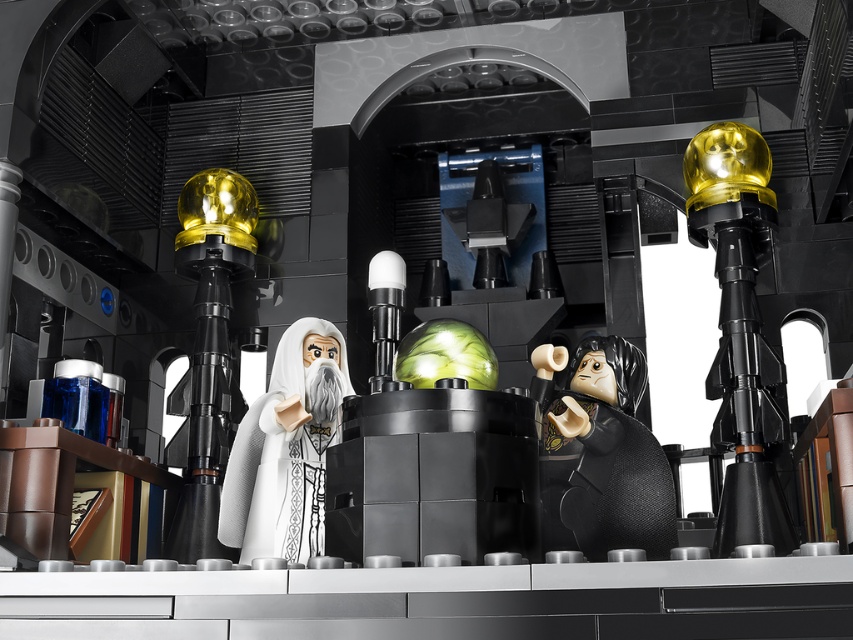
You are a LEGO enthusiast examining this set and want to place a new figure between the black matte figure at center and the white matte wizard at center. Which existing figure is shorter to ensure the new figure can fit between them?

The black matte figure at center is not as tall as the white matte wizard at center, so the new figure should be placed between them by positioning it next to the shorter black matte figure at center.

You are a LEGO designer trying to place a new accessory between the black matte figure at center and the white matte wizard at center. Given that the accessory requires 2 units of space, can you fit it between them based on their widths?

The black matte figure at center is wider than the white matte wizard at center. Since the accessory needs 2 units of space, but the exact width difference isn not specified, it is uncertain if there is enough space between them to place the accessory.

You are a fantasy character entering the dark room and see the gold metallic sphere at left and the white matte wizard at center. Which object is closer to the entrance if you entered from the right side of the room?

The gold metallic sphere at left is closer to the entrance because it is positioned on the left side of the white matte wizard at center, and since you entered from the right, the left side would be nearer to the entrance.